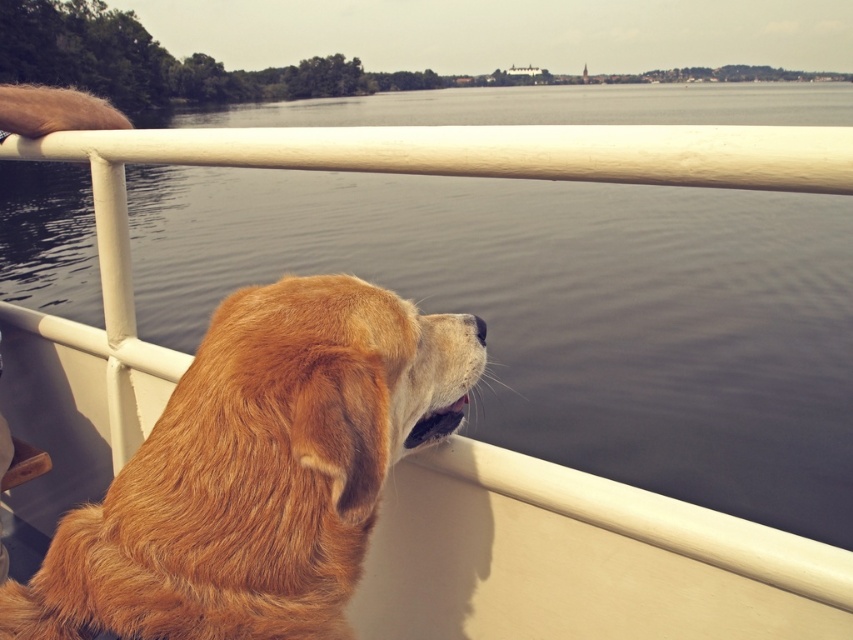
Question: Is smooth water at center to the left of golden fur dog at left from the viewer's perspective?

Choices:
 (A) no
 (B) yes

Answer: (B)

Question: Which object is farther from the camera taking this photo?

Choices:
 (A) smooth water at center
 (B) golden fur dog at left

Answer: (A)

Question: Does smooth water at center have a larger size compared to golden fur dog at left?

Choices:
 (A) yes
 (B) no

Answer: (A)

Question: Which of the following is the farthest from the observer?

Choices:
 (A) (605, 216)
 (B) (50, 568)

Answer: (A)

Question: Which object is farther from the camera taking this photo?

Choices:
 (A) golden fur dog at left
 (B) smooth water at center

Answer: (B)

Question: Is smooth water at center wider than golden fur dog at left?

Choices:
 (A) no
 (B) yes

Answer: (B)